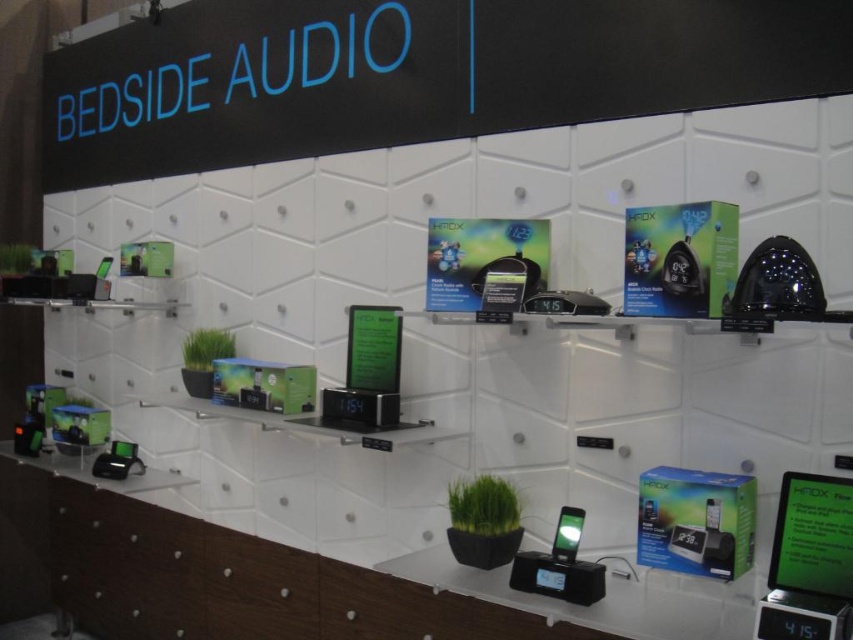
You are a store employee arranging items on the shelf. You need to place a new item that requires 1.2 meters of space. The black plastic sign at upper center and the matte black phone at center are already on the shelf. Which object can you use to estimate the required space for the new item?

The black plastic sign at upper center might be wider than the matte black phone at center, so you can use the black plastic sign at upper center to estimate the required space for the new item since it is likely wider.

You are setting up a display for a new product launch. You have a black plastic sign at upper center and a matte black phone at center. According to the display setup, which object is placed above the other?

The black plastic sign at upper center is positioned over matte black phone at center, meaning the sign is above the phone.